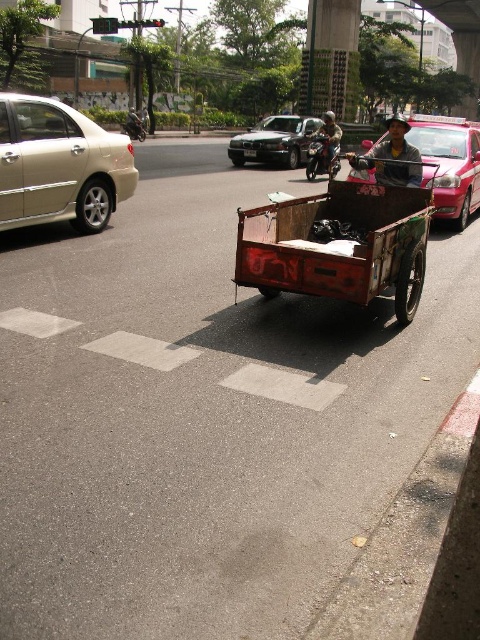
Question: Is shiny black sedan at center smaller than metallic helmet at upper center?

Choices:
 (A) yes
 (B) no

Answer: (B)

Question: Which point is closer to the camera?

Choices:
 (A) (427, 145)
 (B) (260, 125)
 (C) (143, 138)

Answer: (A)

Question: Does metallic pink taxi at center have a larger size compared to shiny metallic motorcycle at center?

Choices:
 (A) yes
 (B) no

Answer: (A)

Question: Does gold metallic sedan at left appear under black plastic license plate at center?

Choices:
 (A) yes
 (B) no

Answer: (A)

Question: Which is nearer to the metallic helmet at upper center?

Choices:
 (A) shiny black motorcycle at center
 (B) black plastic license plate at center
 (C) shiny black sedan at center
 (D) gold metallic sedan at left

Answer: (A)

Question: Which point is farther from the camera taking this photo?

Choices:
 (A) coord(263,134)
 (B) coord(420,163)
 (C) coord(465,120)

Answer: (C)